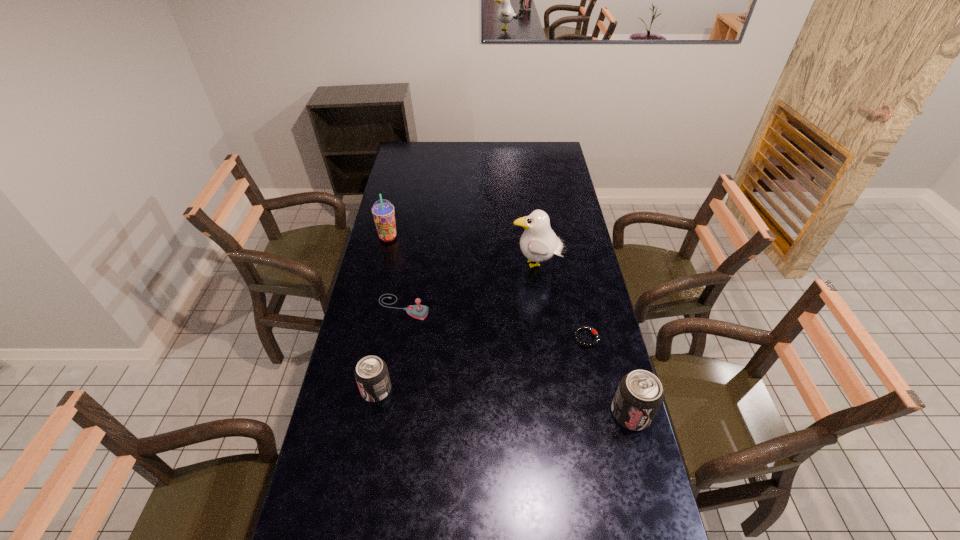
Where is `the shorter soda can`? The image size is (960, 540). the shorter soda can is located at coordinates (371, 373).

Identify the location of the left soda can. (371, 373).

Locate an element on the screen. The height and width of the screenshot is (540, 960). the right soda can is located at coordinates (640, 394).

Image resolution: width=960 pixels, height=540 pixels. Find the location of `the taller soda can`. the taller soda can is located at coordinates (640, 394).

Find the location of a particular element. The image size is (960, 540). the fifth shortest object is located at coordinates (383, 213).

This screenshot has width=960, height=540. Identify the location of the farthest object. (383, 213).

Identify the location of the tallest object. (538, 243).

The height and width of the screenshot is (540, 960). Identify the location of the second farthest object. (538, 243).

The height and width of the screenshot is (540, 960). I want to click on the third farthest object, so click(418, 311).

Where is `joystick`? joystick is located at coordinates (418, 311).